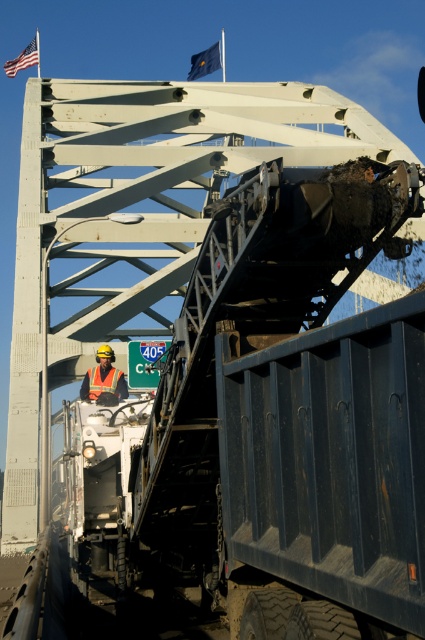
Which is in front, point (93, 376) or point (203, 51)?

Positioned in front is point (93, 376).

Is orange reflective vest at center smaller than blue fabric flag at upper center?

Yes.

Is point (99, 387) closer to viewer compared to point (195, 61)?

Yes, point (99, 387) is closer to viewer.

Locate an element on the screen. This screenshot has width=425, height=640. orange reflective vest at center is located at coordinates (104, 378).

Does orange reflective vest at center have a lesser width compared to orange reflective safety vest at center?

No.

Does orange reflective vest at center have a greater width compared to orange reflective safety vest at center?

Yes, orange reflective vest at center is wider than orange reflective safety vest at center.

Is point (119, 371) closer to camera compared to point (119, 372)?

No.

The width and height of the screenshot is (425, 640). I want to click on orange reflective vest at center, so click(104, 378).

Between blue fabric flag at upper center and orange reflective safety vest at center, which one appears on the right side from the viewer's perspective?

From the viewer's perspective, blue fabric flag at upper center appears more on the right side.

Locate an element on the screen. The width and height of the screenshot is (425, 640). blue fabric flag at upper center is located at coordinates (206, 61).

The height and width of the screenshot is (640, 425). I want to click on blue fabric flag at upper center, so click(x=206, y=61).